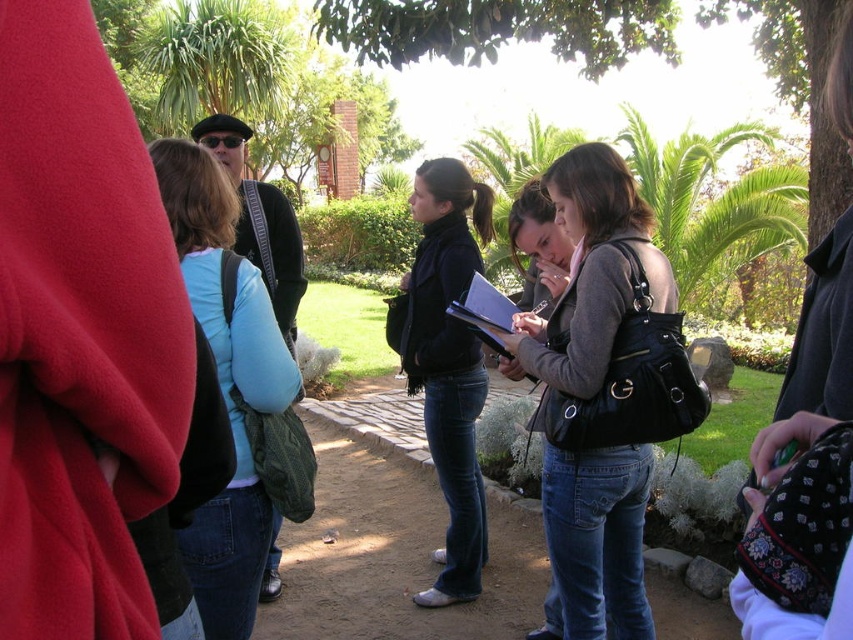
You are a photographer trying to capture a photo of the light blue sweater at center and the black matte scarf at center. Which object should you focus on first if you want to ensure both are in sharp focus, given their positions relative to the camera?

The light blue sweater at center is shorter than the black matte scarf at center, so you should focus on the black matte scarf at center first to ensure both are in sharp focus since it is farther away and requires a smaller depth of field adjustment.

In the scene shown: You are organizing a photo shoot and need to ensure that all items in the frame are visible. Given that the matte black purse at center and the black matte scarf at center are both in the center, which item takes up more visual space in the photo?

The black matte scarf at center occupies more visual space than the matte black purse at center because the description states that the purse occupies less space than the scarf.

You are standing in a park and see a matte black purse at center. If you want to pick it up, how many steps would you need to take if each step covers 2.5 feet?

The matte black purse at center is 7.55 feet away from viewer. Dividing the distance by step length, 7.55 divided by 2.5 equals approximately 3.02 steps. Since you can only take whole steps, you would need to take 4 steps to reach the matte black purse at center.